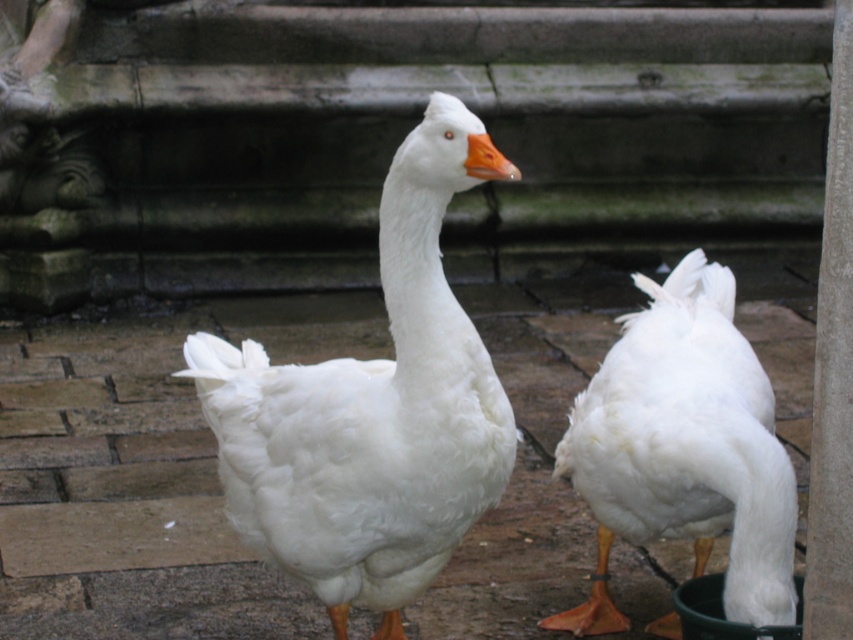
You are a farmer checking the distance between the white fluffy goose at center and the white fluffy duck at lower right to ensure they have enough space. The minimum required distance for their comfort is 20 inches. Can they comfortably coexist in this area?

The distance between the white fluffy goose at center and the white fluffy duck at lower right is 20.31 inches, which exceeds the minimum required 20 inches. Therefore, they can comfortably coexist in this area.

You are a photographer trying to capture both the white fluffy goose at center and the white fluffy duck at lower right in a single frame. Based on their positions, which one is located more to the left side of the image?

The white fluffy goose at center is positioned on the left side of the white fluffy duck at lower right, so the white fluffy goose at center is more to the left.

You are a photographer trying to capture both geese in a single shot. The geese are located at point (495, 385) and point (677, 323). Which goose is closer to the camera?

Point (495, 385) is in front of point (677, 323), so the goose at point (495, 385) is closer to the camera.